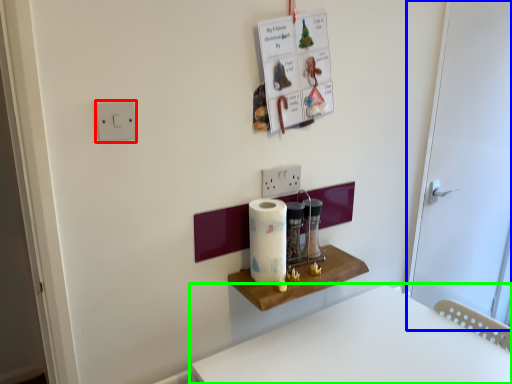
Question: Which object is positioned closest to light switch (highlighted by a red box)? Select from door (highlighted by a blue box) and furniture (highlighted by a green box).

Choices:
 (A) door
 (B) furniture

Answer: (B)